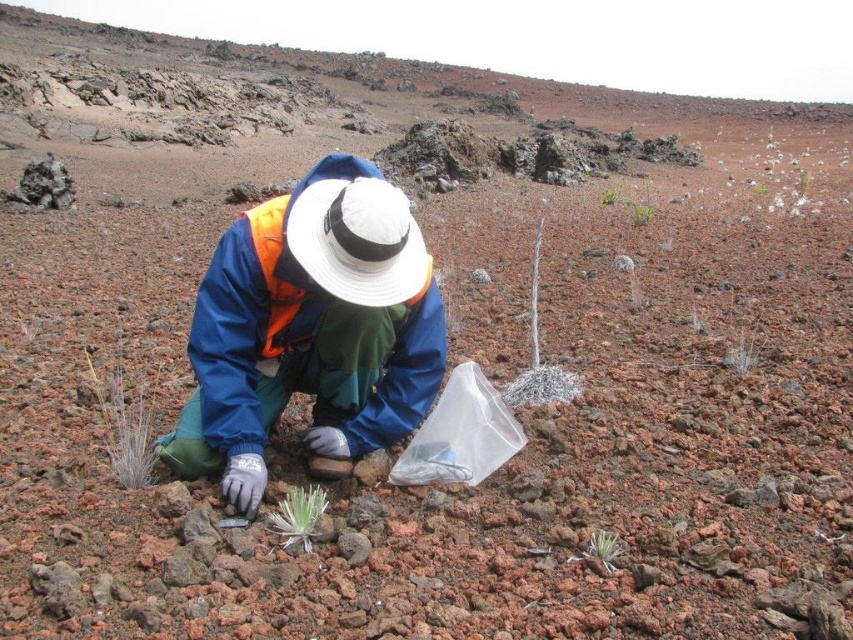
You are a field assistant observing the scientist in the image. The scientist is wearing a blue fabric jacket at center and a white fabric hat at center. Which piece of clothing is positioned more to the left?

The blue fabric jacket at center is positioned more to the left than the white fabric hat at center.

You are a field researcher in a volcanic area. You need to collect samples from both the dry twig at center and the green fuzzy plant at center. Which object should you reach for first if you want to collect the taller one without standing up?

The dry twig at center is much taller than the green fuzzy plant at center, so you should reach for the dry twig at center first to collect the taller one without standing up.

You are a drone operator trying to capture a closeup of the person collecting samples in the barren landscape. You have two points marked on your screen, point A at coordinates point [306,289] and point B at coordinates point [370,186]. Which point should you focus on to get a closer shot of the person?

Point A at coordinates point [306,289] is further to the camera than point B at coordinates point [370,186]. To get a closer shot of the person, you should focus on point B because it is closer to the camera.